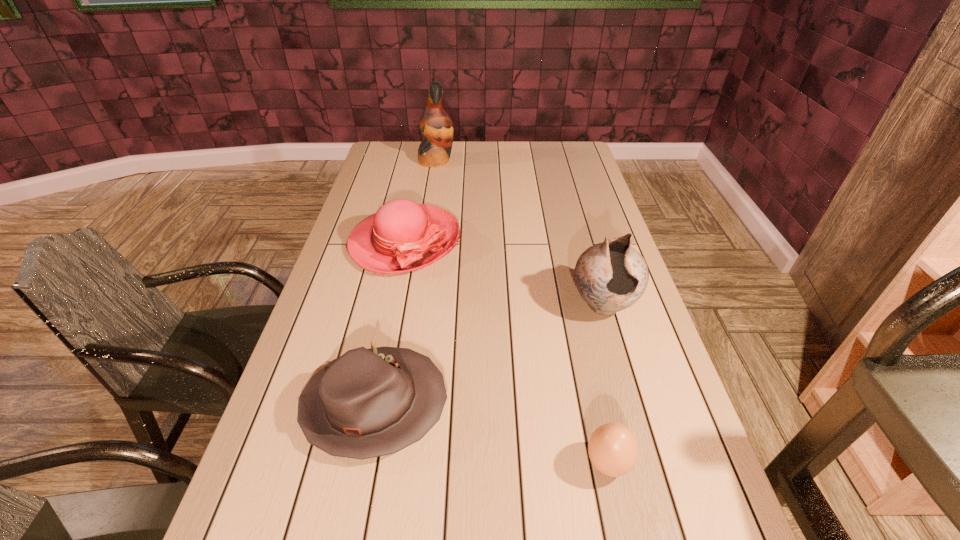
The width and height of the screenshot is (960, 540). In order to click on vacant space that is in between the second farthest object and the boiled egg in this screenshot , I will do `click(506, 352)`.

The width and height of the screenshot is (960, 540). I want to click on free spot between the pottery and the parrot, so click(519, 233).

Find the location of a particular element. Image resolution: width=960 pixels, height=540 pixels. free spot between the boiled egg and the fourth shortest object is located at coordinates (605, 384).

I want to click on free space between the tallest object and the third shortest object, so pyautogui.click(x=420, y=201).

You are a GUI agent. You are given a task and a screenshot of the screen. Output one action in this format:
    pyautogui.click(x=<x>, y=<y>)
    Task: Click on the free space between the taller hat and the boiled egg
    This screenshot has width=960, height=540.
    Given the screenshot: What is the action you would take?
    pyautogui.click(x=506, y=352)

Locate an element on the screen. This screenshot has height=540, width=960. blank region between the farthest object and the boiled egg is located at coordinates (522, 312).

I want to click on free space between the parrot and the boiled egg, so click(x=522, y=312).

The height and width of the screenshot is (540, 960). In order to click on unoccupied area between the boiled egg and the taller hat in this screenshot , I will do `click(506, 352)`.

Locate an element on the screen. The width and height of the screenshot is (960, 540). vacant area that lies between the shorter hat and the tallest object is located at coordinates (406, 283).

Find the location of a particular element. This screenshot has height=540, width=960. empty space between the third nearest object and the farthest object is located at coordinates (519, 233).